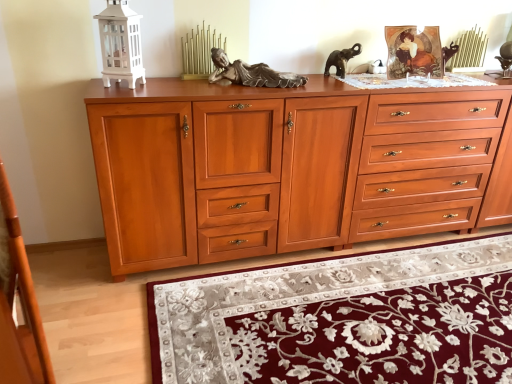
Locate an element on the screen. cherry wood drawers at right, acting as the 2th drawer starting from the left is located at coordinates (426, 162).

In order to click on velvet burgundy rug at lower center in this screenshot , I will do `click(343, 319)`.

Identify the location of cherry wood chest of drawers at center. This screenshot has width=512, height=384. (250, 165).

Is wooden drawer at center, which ranks as the first drawer in left-to-right order, shorter than cherry wood chest of drawers at center?

Yes, wooden drawer at center, which ranks as the first drawer in left-to-right order, is shorter than cherry wood chest of drawers at center.

From a real-world perspective, is wooden drawer at center, which is the 2th drawer from right to left, physically located above or below cherry wood chest of drawers at center?

From a real-world perspective, wooden drawer at center, which is the 2th drawer from right to left, is physically above cherry wood chest of drawers at center.

Based on the photo, from the image's perspective, does wooden drawer at center, which ranks as the first drawer in left-to-right order, appear lower than cherry wood chest of drawers at center?

No.

Is wooden drawer at center, which ranks as the first drawer in left-to-right order, touching cherry wood chest of drawers at center?

No, wooden drawer at center, which ranks as the first drawer in left-to-right order, is not with cherry wood chest of drawers at center.

From the image's perspective, does cherry wood drawers at right, acting as the 2th drawer starting from the left, appear lower than velvet burgundy rug at lower center?

Incorrect, from the image's perspective, cherry wood drawers at right, acting as the 2th drawer starting from the left, is higher than velvet burgundy rug at lower center.

Considering the positions of objects cherry wood drawers at right, which is the 1th drawer from right to left, and velvet burgundy rug at lower center in the image provided, who is more to the left, cherry wood drawers at right, which is the 1th drawer from right to left, or velvet burgundy rug at lower center?

velvet burgundy rug at lower center.

Which is behind, cherry wood drawers at right, acting as the 2th drawer starting from the left, or velvet burgundy rug at lower center?

cherry wood drawers at right, acting as the 2th drawer starting from the left, is behind.

Considering the sizes of objects cherry wood drawers at right, which is the 1th drawer from right to left, and velvet burgundy rug at lower center in the image provided, who is bigger, cherry wood drawers at right, which is the 1th drawer from right to left, or velvet burgundy rug at lower center?

cherry wood drawers at right, which is the 1th drawer from right to left, is bigger.

Does velvet burgundy rug at lower center come behind cherry wood drawers at right, acting as the 2th drawer starting from the left?

No.

How distant is velvet burgundy rug at lower center from cherry wood drawers at right, acting as the 2th drawer starting from the left?

velvet burgundy rug at lower center is 26.04 inches away from cherry wood drawers at right, acting as the 2th drawer starting from the left.

The image size is (512, 384). In order to click on mat on the left of the cherry wood drawers at right, acting as the 2th drawer starting from the left in this screenshot , I will do 343,319.

Does velvet burgundy rug at lower center have a smaller size compared to cherry wood drawers at right, acting as the 2th drawer starting from the left?

Indeed, velvet burgundy rug at lower center has a smaller size compared to cherry wood drawers at right, acting as the 2th drawer starting from the left.

Is cherry wood chest of drawers at center positioned with its back to cherry wood drawers at right, which is the 1th drawer from right to left?

No.

Which of these two, cherry wood chest of drawers at center or cherry wood drawers at right, acting as the 2th drawer starting from the left, is bigger?

Bigger between the two is cherry wood chest of drawers at center.

Which of these two, cherry wood chest of drawers at center or cherry wood drawers at right, which is the 1th drawer from right to left, stands taller?

Standing taller between the two is cherry wood chest of drawers at center.

Between cherry wood drawers at right, acting as the 2th drawer starting from the left, and cherry wood chest of drawers at center, which one has smaller size?

cherry wood drawers at right, acting as the 2th drawer starting from the left, is smaller.

Is cherry wood drawers at right, acting as the 2th drawer starting from the left, positioned far away from cherry wood chest of drawers at center?

Actually, cherry wood drawers at right, acting as the 2th drawer starting from the left, and cherry wood chest of drawers at center are a little close together.

From the image's perspective, would you say cherry wood drawers at right, which is the 1th drawer from right to left, is positioned over cherry wood chest of drawers at center?

Yes, from the image's perspective, cherry wood drawers at right, which is the 1th drawer from right to left, is on top of cherry wood chest of drawers at center.

Considering the sizes of objects velvet burgundy rug at lower center and cherry wood chest of drawers at center in the image provided, who is taller, velvet burgundy rug at lower center or cherry wood chest of drawers at center?

cherry wood chest of drawers at center is taller.

Is velvet burgundy rug at lower center wider or thinner than cherry wood chest of drawers at center?

In the image, velvet burgundy rug at lower center appears to be wider than cherry wood chest of drawers at center.

Identify the location of mat that appears below the cherry wood chest of drawers at center (from a real-world perspective). (343, 319).

Can you confirm if cherry wood drawers at right, which is the 1th drawer from right to left, is shorter than wooden drawer at center, which ranks as the first drawer in left-to-right order?

Correct, cherry wood drawers at right, which is the 1th drawer from right to left, is not as tall as wooden drawer at center, which ranks as the first drawer in left-to-right order.

Between cherry wood drawers at right, acting as the 2th drawer starting from the left, and wooden drawer at center, which ranks as the first drawer in left-to-right order, which one has larger width?

cherry wood drawers at right, acting as the 2th drawer starting from the left.

From the image's perspective, between cherry wood drawers at right, acting as the 2th drawer starting from the left, and wooden drawer at center, which is the 2th drawer from right to left, which one is located above?

cherry wood drawers at right, acting as the 2th drawer starting from the left, from the image's perspective.

Is cherry wood drawers at right, which is the 1th drawer from right to left, not close to wooden drawer at center, which ranks as the first drawer in left-to-right order?

No, there isn't a large distance between cherry wood drawers at right, which is the 1th drawer from right to left, and wooden drawer at center, which ranks as the first drawer in left-to-right order.

This screenshot has width=512, height=384. I want to click on chest of drawers below the wooden drawer at center, which ranks as the first drawer in left-to-right order (from a real-world perspective), so click(250, 165).

At what (x,y) coordinates should I click in order to perform the action: click on mat located in front of the cherry wood drawers at right, acting as the 2th drawer starting from the left. Please return your answer as a coordinate pair (x, y). Looking at the image, I should click on (343, 319).

When comparing their distances from wooden drawer at center, which is the 2th drawer from right to left, does velvet burgundy rug at lower center or cherry wood chest of drawers at center seem closer?

Based on the image, cherry wood chest of drawers at center appears to be nearer to wooden drawer at center, which is the 2th drawer from right to left.

Estimate the real-world distances between objects in this image. Which object is further from wooden drawer at center, which is the 2th drawer from right to left, velvet burgundy rug at lower center or cherry wood drawers at right, which is the 1th drawer from right to left?

Among the two, cherry wood drawers at right, which is the 1th drawer from right to left, is located further to wooden drawer at center, which is the 2th drawer from right to left.

Considering their positions, is velvet burgundy rug at lower center positioned further to cherry wood chest of drawers at center than wooden drawer at center, which ranks as the first drawer in left-to-right order?

Among the two, velvet burgundy rug at lower center is located further to cherry wood chest of drawers at center.

From the image, which object appears to be nearer to velvet burgundy rug at lower center, cherry wood chest of drawers at center or cherry wood drawers at right, which is the 1th drawer from right to left?

cherry wood chest of drawers at center.

Which object lies nearer to the anchor point cherry wood chest of drawers at center, wooden drawer at center, which is the 2th drawer from right to left, or cherry wood drawers at right, acting as the 2th drawer starting from the left?

wooden drawer at center, which is the 2th drawer from right to left, is positioned closer to the anchor cherry wood chest of drawers at center.

Considering their positions, is cherry wood chest of drawers at center positioned closer to cherry wood drawers at right, which is the 1th drawer from right to left, than velvet burgundy rug at lower center?

cherry wood chest of drawers at center lies closer to cherry wood drawers at right, which is the 1th drawer from right to left, than the other object.

Looking at the image, which one is located closer to velvet burgundy rug at lower center, wooden drawer at center, which is the 2th drawer from right to left, or cherry wood drawers at right, which is the 1th drawer from right to left?

cherry wood drawers at right, which is the 1th drawer from right to left, lies closer to velvet burgundy rug at lower center than the other object.

Looking at the image, which one is located further to cherry wood drawers at right, which is the 1th drawer from right to left, velvet burgundy rug at lower center or wooden drawer at center, which ranks as the first drawer in left-to-right order?

Based on the image, wooden drawer at center, which ranks as the first drawer in left-to-right order, appears to be further to cherry wood drawers at right, which is the 1th drawer from right to left.

In order to click on mat located between wooden drawer at center, which is the 2th drawer from right to left, and cherry wood drawers at right, acting as the 2th drawer starting from the left, in the left-right direction in this screenshot , I will do `click(343, 319)`.

The height and width of the screenshot is (384, 512). Find the location of `chest of drawers between wooden drawer at center, which is the 2th drawer from right to left, and velvet burgundy rug at lower center, in the vertical direction`. chest of drawers between wooden drawer at center, which is the 2th drawer from right to left, and velvet burgundy rug at lower center, in the vertical direction is located at coordinates (250, 165).

In order to click on chest of drawers between wooden drawer at center, which ranks as the first drawer in left-to-right order, and cherry wood drawers at right, acting as the 2th drawer starting from the left in this screenshot , I will do `click(250, 165)`.

You are a GUI agent. You are given a task and a screenshot of the screen. Output one action in this format:
    pyautogui.click(x=<x>, y=<y>)
    Task: Click on the chest of drawers between cherry wood drawers at right, acting as the 2th drawer starting from the left, and velvet burgundy rug at lower center vertically
    The height and width of the screenshot is (384, 512).
    Given the screenshot: What is the action you would take?
    pyautogui.click(x=250, y=165)